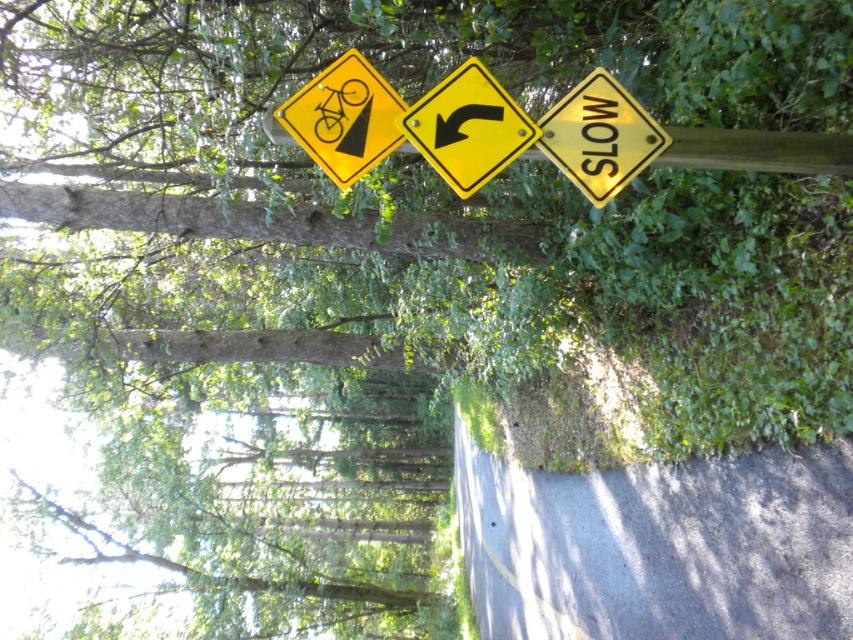
Question: Which point appears closest to the camera in this image?

Choices:
 (A) (442, 115)
 (B) (576, 148)
 (C) (378, 84)

Answer: (A)

Question: Is yellow plastic arrow at center further to camera compared to yellow matte/solid sign at right?

Choices:
 (A) yes
 (B) no

Answer: (B)

Question: Is the position of yellow plastic arrow at center more distant than that of yellow matte bicycle sign at upper center?

Choices:
 (A) no
 (B) yes

Answer: (A)

Question: Considering the real-world distances, which object is farthest from the yellow plastic arrow at center?

Choices:
 (A) yellow matte/solid sign at right
 (B) yellow matte bicycle sign at upper center

Answer: (A)

Question: Is yellow plastic arrow at center bigger than yellow matte bicycle sign at upper center?

Choices:
 (A) no
 (B) yes

Answer: (A)

Question: Based on their relative distances, which object is nearer to the yellow matte bicycle sign at upper center?

Choices:
 (A) yellow matte/solid sign at right
 (B) yellow plastic arrow at center

Answer: (B)